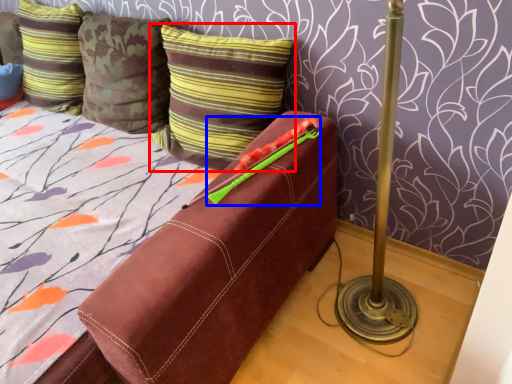
Question: Which object is closer to the camera taking this photo, pillow (highlighted by a red box) or crayon (highlighted by a blue box)?

Choices:
 (A) pillow
 (B) crayon

Answer: (B)